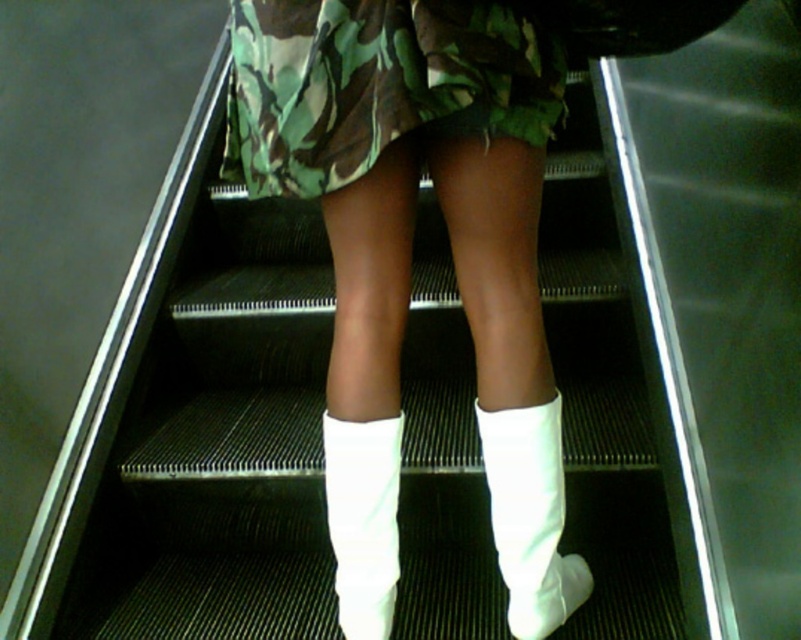
Question: Which object is the closest to the white smooth sock at center?

Choices:
 (A) white leather boots at center
 (B) white suede boot at center
 (C) camo fabric skirt at center

Answer: (A)

Question: Among these points, which one is farthest from the camera?

Choices:
 (A) (421, 49)
 (B) (558, 452)
 (C) (341, 570)

Answer: (C)

Question: Is white suede boot at center positioned in front of white smooth sock at center?

Choices:
 (A) yes
 (B) no

Answer: (A)

Question: Is the position of white leather boots at center less distant than that of camo fabric skirt at center?

Choices:
 (A) yes
 (B) no

Answer: (B)

Question: Does white leather boots at center appear over white smooth sock at center?

Choices:
 (A) no
 (B) yes

Answer: (B)

Question: Which of the following is the closest to the observer?

Choices:
 (A) (502, 426)
 (B) (482, 48)
 (C) (349, 8)

Answer: (B)